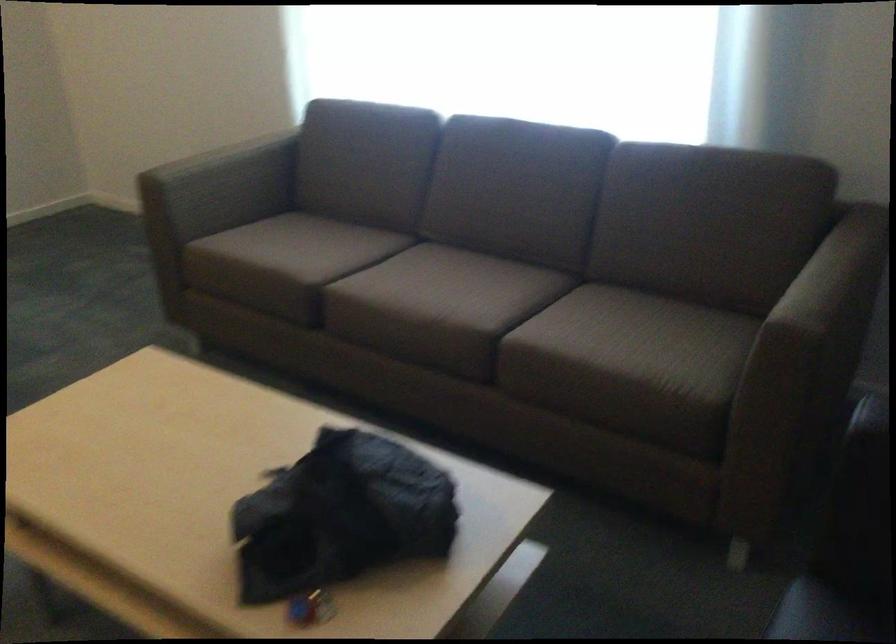
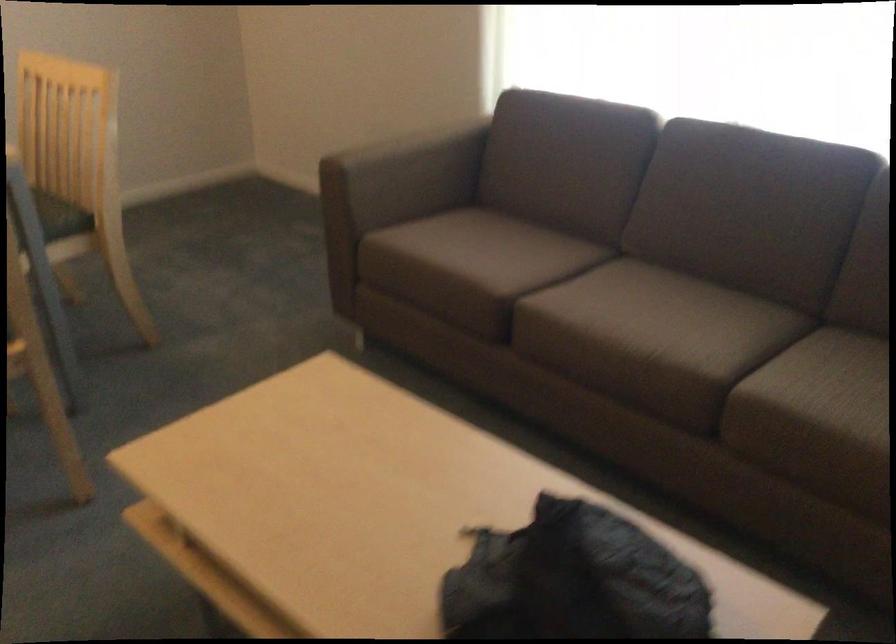
Question: The first image is from the beginning of the video and the second image is from the end. How did the camera likely rotate when shooting the video?

Choices:
 (A) Left
 (B) Right
 (C) Up
 (D) Down

Answer: (A)